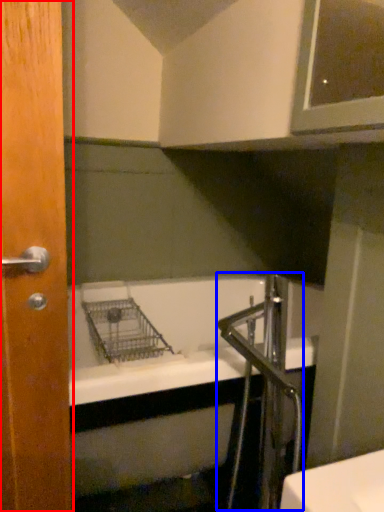
Question: Which point is closer to the camera, door (highlighted by a red box) or faucet (highlighted by a blue box)?

Choices:
 (A) door
 (B) faucet

Answer: (A)